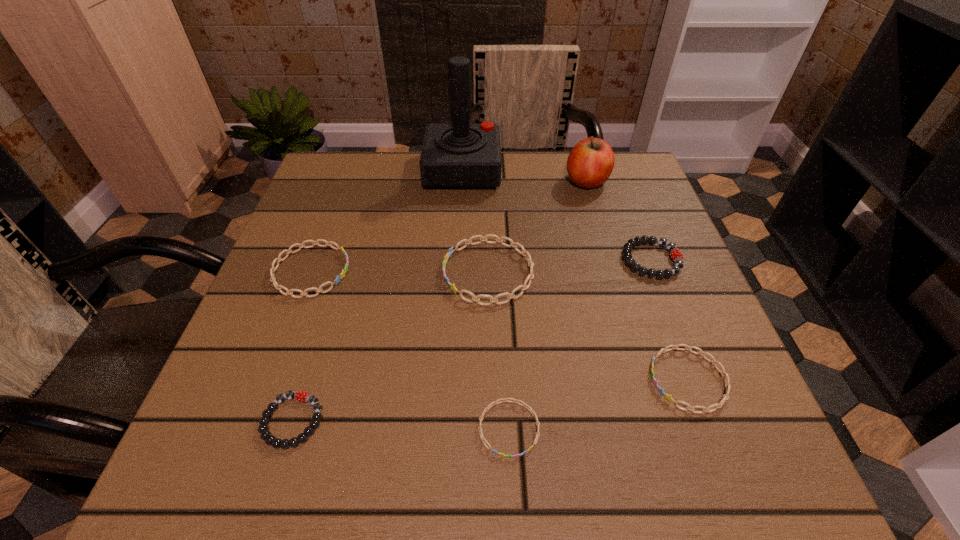
At what (x,y) coordinates should I click in order to perform the action: click on vacant space at the near edge of the desktop. Please return your answer as a coordinate pair (x, y). Image resolution: width=960 pixels, height=540 pixels. Looking at the image, I should click on (405, 431).

Identify the location of vacant area at the left edge of the desktop. The image size is (960, 540). (333, 333).

The height and width of the screenshot is (540, 960). I want to click on free space at the right edge, so click(621, 233).

Image resolution: width=960 pixels, height=540 pixels. What are the coordinates of `vacant region at the far left corner` in the screenshot? It's located at (348, 168).

I want to click on vacant region at the far right corner of the desktop, so click(x=634, y=184).

Find the location of a particular element. free point between the right black bracelet and the third smallest blue bracelet is located at coordinates (481, 266).

Locate an element on the screen. Image resolution: width=960 pixels, height=540 pixels. free point between the biggest blue bracelet and the third smallest blue bracelet is located at coordinates (400, 272).

The height and width of the screenshot is (540, 960). Find the location of `empty space that is in between the right black bracelet and the second smallest blue bracelet`. empty space that is in between the right black bracelet and the second smallest blue bracelet is located at coordinates (670, 320).

Image resolution: width=960 pixels, height=540 pixels. In order to click on empty space between the joystick and the bigger black bracelet in this screenshot , I will do `click(557, 215)`.

Identify the location of free space between the farther black bracelet and the second smallest blue bracelet. This screenshot has width=960, height=540. [670, 320].